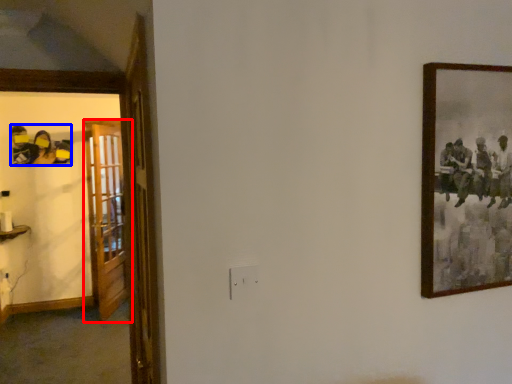
Question: Which object is further to the camera taking this photo, door (highlighted by a red box) or art (highlighted by a blue box)?

Choices:
 (A) door
 (B) art

Answer: (B)